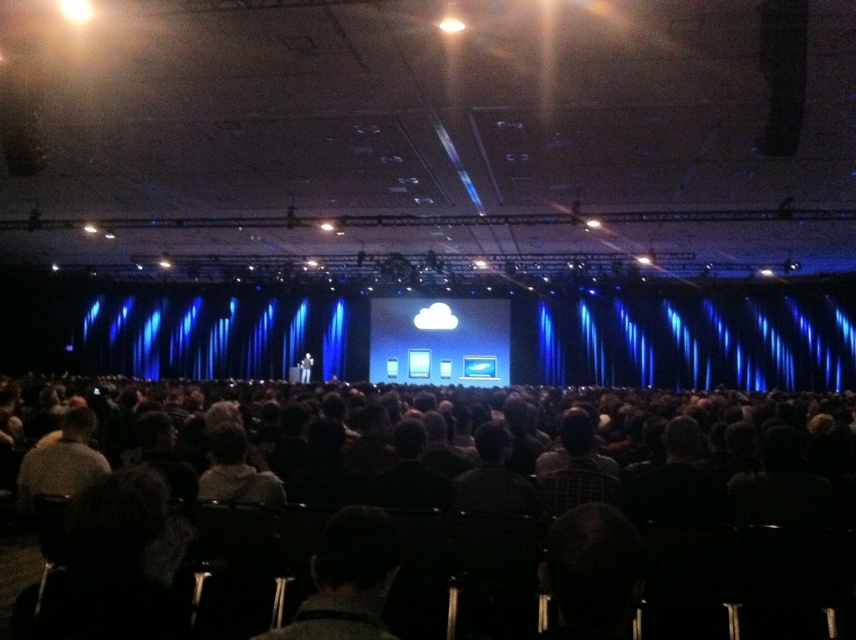
Who is more distant from viewer, [774,568] or [308,376]?

The point [308,376] is behind.

Who is taller, dark gray chairs at center or dark suit at center?

dark gray chairs at center is taller.

Is point (591, 476) positioned behind point (308, 365)?

No, it is in front of (308, 365).

At what (x,y) coordinates should I click in order to perform the action: click on dark gray chairs at center. Please return your answer as a coordinate pair (x, y). Looking at the image, I should click on (619, 570).

In the scene shown: Can you confirm if dark woolen sweater at center is positioned above dark suit at center?

Yes.

Is dark woolen sweater at center bigger than dark suit at center?

No.

Locate an element on the screen. dark woolen sweater at center is located at coordinates (348, 579).

Measure the distance between point (209, 600) and camera.

Point (209, 600) and camera are 4.06 meters apart.

Is point (498, 634) positioned before point (363, 564)?

That is False.

The height and width of the screenshot is (640, 856). What do you see at coordinates (619, 570) in the screenshot?
I see `dark gray chairs at center` at bounding box center [619, 570].

This screenshot has height=640, width=856. Find the location of `dark gray chairs at center`. dark gray chairs at center is located at coordinates (619, 570).